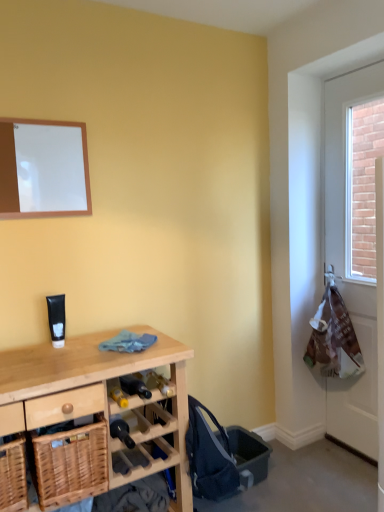
Question: Is white plastic bag at right positioned in front of white matte board at upper left?

Choices:
 (A) yes
 (B) no

Answer: (B)

Question: From the image's perspective, is white plastic bag at right over white matte board at upper left?

Choices:
 (A) no
 (B) yes

Answer: (A)

Question: Considering the relative sizes of white plastic bag at right and white matte board at upper left in the image provided, is white plastic bag at right wider than white matte board at upper left?

Choices:
 (A) yes
 (B) no

Answer: (A)

Question: Does white plastic bag at right appear on the right side of white matte board at upper left?

Choices:
 (A) yes
 (B) no

Answer: (A)

Question: Considering the relative sizes of white plastic bag at right and white matte board at upper left in the image provided, is white plastic bag at right shorter than white matte board at upper left?

Choices:
 (A) yes
 (B) no

Answer: (B)

Question: Is white plastic bag at right facing towards white matte board at upper left?

Choices:
 (A) no
 (B) yes

Answer: (B)

Question: From a real-world perspective, is woven wood basket at lower left, which ranks as the 2th basket in left-to-right order, physically above woven wood basket at lower left, the 2th basket in the right-to-left sequence?

Choices:
 (A) yes
 (B) no

Answer: (A)

Question: From a real-world perspective, is woven wood basket at lower left, which ranks as the first basket in right-to-left order, beneath woven wood basket at lower left, acting as the first basket starting from the left?

Choices:
 (A) no
 (B) yes

Answer: (A)

Question: Is woven wood basket at lower left, which ranks as the first basket in right-to-left order, located outside woven wood basket at lower left, the 2th basket in the right-to-left sequence?

Choices:
 (A) yes
 (B) no

Answer: (A)

Question: From the image's perspective, would you say woven wood basket at lower left, which ranks as the first basket in right-to-left order, is shown under woven wood basket at lower left, acting as the first basket starting from the left?

Choices:
 (A) yes
 (B) no

Answer: (B)

Question: Does woven wood basket at lower left, which ranks as the first basket in right-to-left order, lie behind woven wood basket at lower left, the 2th basket in the right-to-left sequence?

Choices:
 (A) no
 (B) yes

Answer: (B)

Question: Is woven wood basket at lower left, which ranks as the 2th basket in left-to-right order, at the right side of woven wood basket at lower left, acting as the first basket starting from the left?

Choices:
 (A) no
 (B) yes

Answer: (B)

Question: Is the position of wooden desk at lower left more distant than that of woven wood basket at lower left, which ranks as the 2th basket in left-to-right order?

Choices:
 (A) yes
 (B) no

Answer: (B)